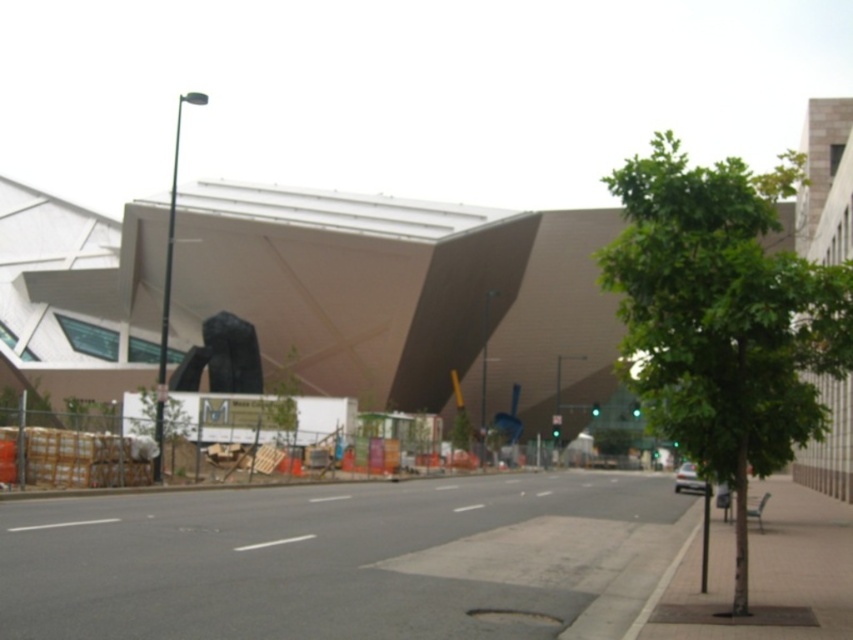
Between smooth concrete building at center and green leafy tree at right, which one has less height?

Standing shorter between the two is smooth concrete building at center.

Where is `smooth concrete building at center`? The image size is (853, 640). smooth concrete building at center is located at coordinates (403, 296).

The image size is (853, 640). What are the coordinates of `smooth concrete building at center` in the screenshot? It's located at (403, 296).